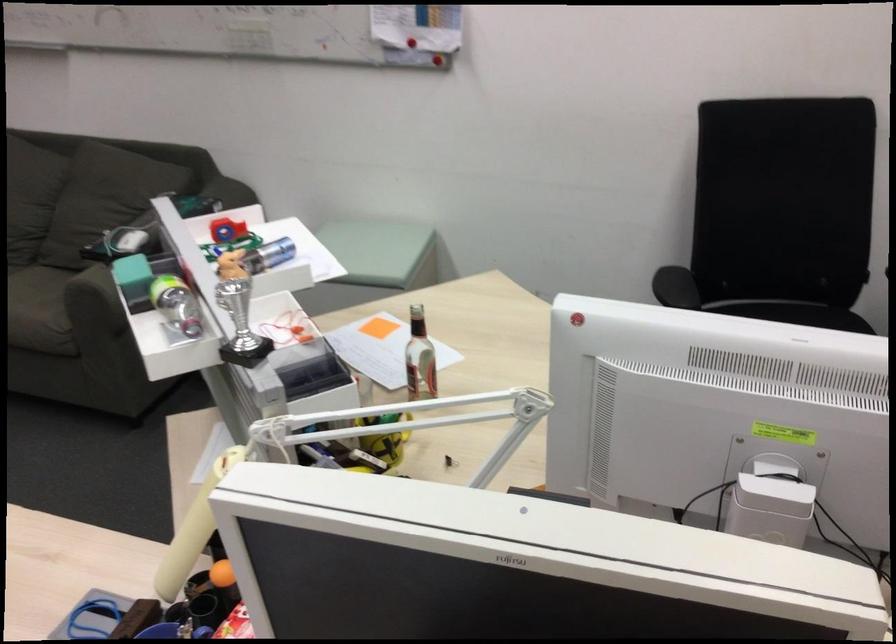
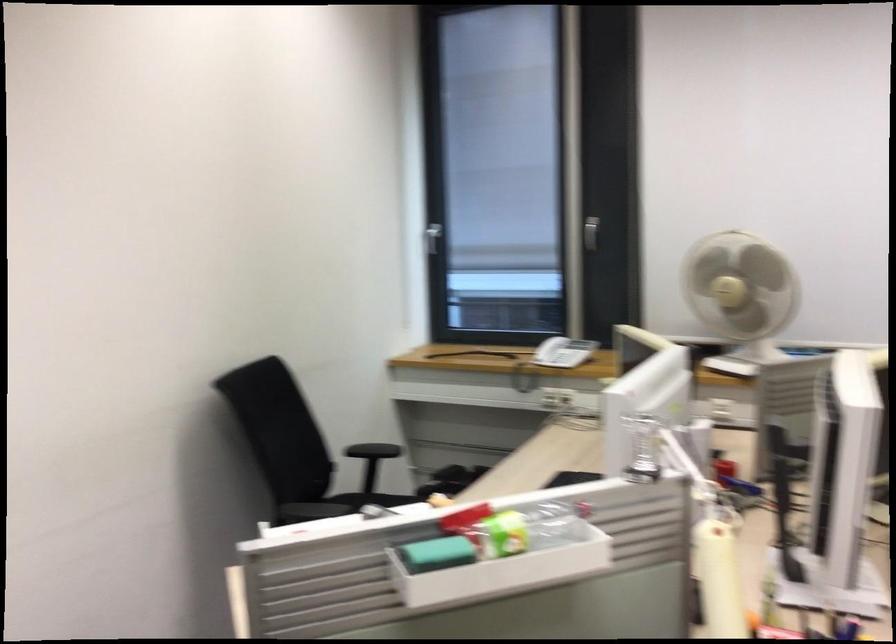
The point at (128, 292) is marked in the first image. Where is the corresponding point in the second image?

(436, 554)